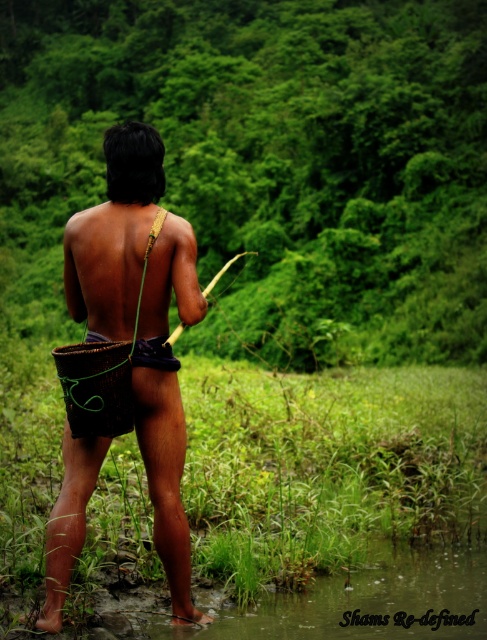
You are a photographer planning to capture the scene with the green leafy vegetation at center and the brown woven basket at center. Which object should you focus on if you want to highlight the wider subject in your photo?

The green leafy vegetation at center has a greater width than the brown woven basket at center, so focusing on it would highlight the wider subject.

You are standing at the edge of a forest and see the green leafy vegetation at center in front of you. If you want to reach it, how many steps do you think you need to take? Assume each step covers about 0.75 meters.

The green leafy vegetation at center is 5.81 meters away from you. Since each step covers 0.75 meters, you would need approximately 8 steps to reach it.